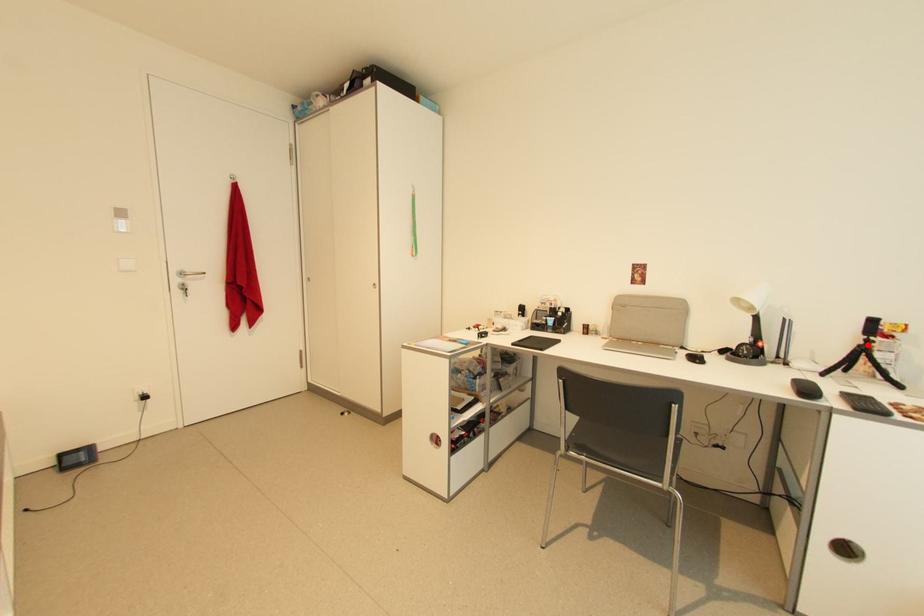
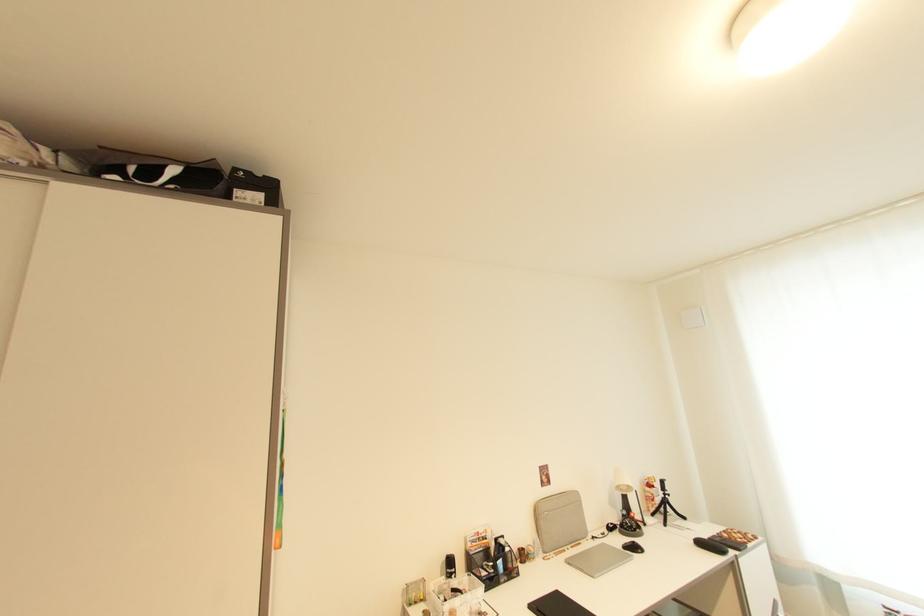
Where in the second image is the point corresponding to the highlighted location from the first image?

(669, 498)